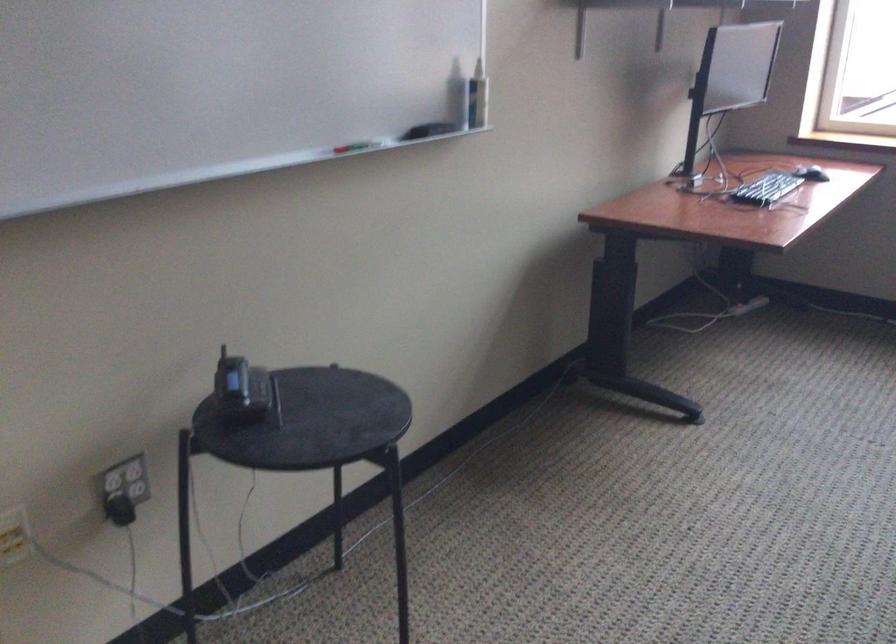
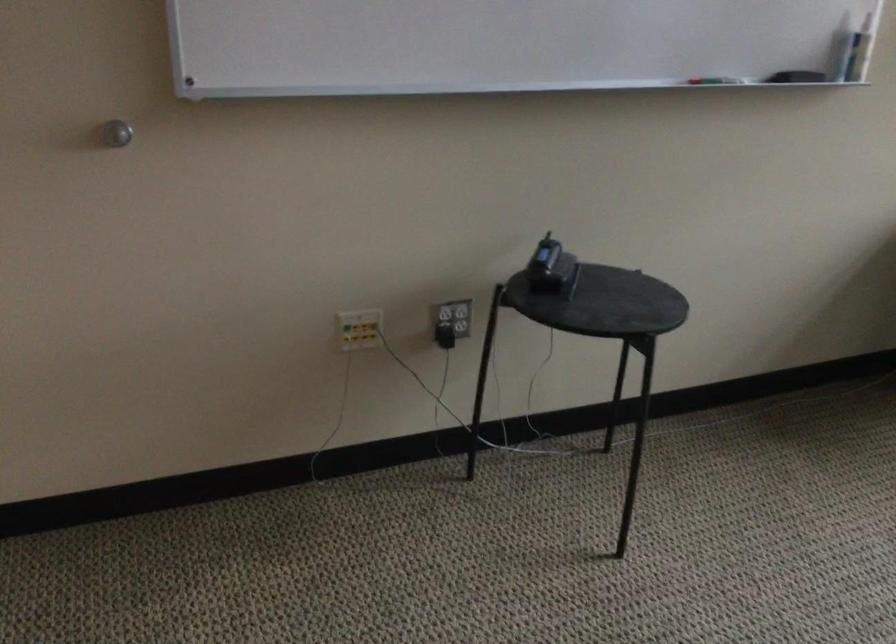
The point at (252, 397) is marked in the first image. Where is the corresponding point in the second image?

(550, 268)